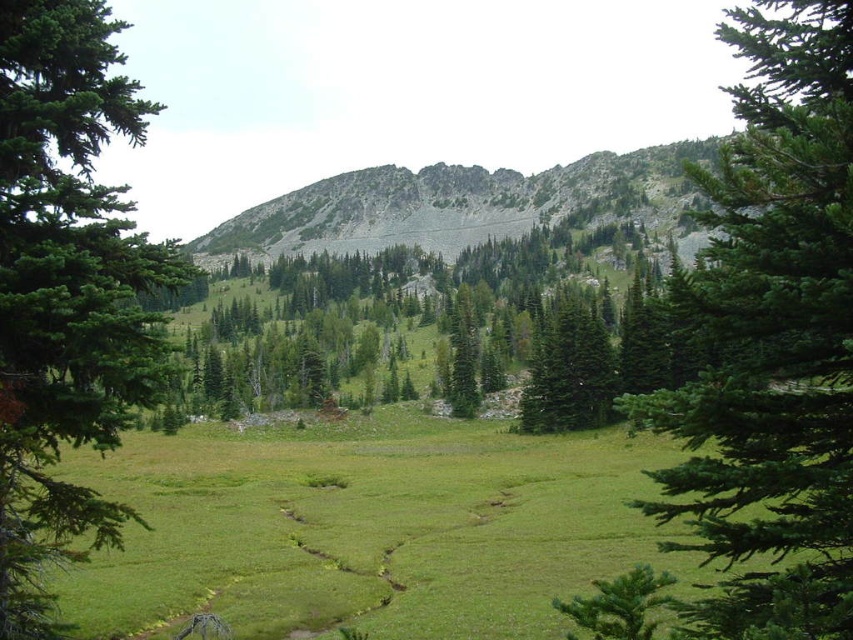
You are standing in the meadow and see a point marked at coordinates (65, 289). Based on the scene description, can you determine what object this point is located on?

The point at coordinates (65, 289) is located on the green needle like tree at left.

You are a hiker planning to cross the meadow and need to decide whether to go around the gray rocky mountain at center or the green matte tree at center. Which one requires more space to navigate around?

The gray rocky mountain at center might be wider than green matte tree at center, so navigating around the gray rocky mountain at center would require more space.

You are a hiker planning to cross the meadow. You see the gray rocky mountain at center and the green matte tree at center. Which object is bigger in size?

The gray rocky mountain at center is larger in size than the green matte tree at center.